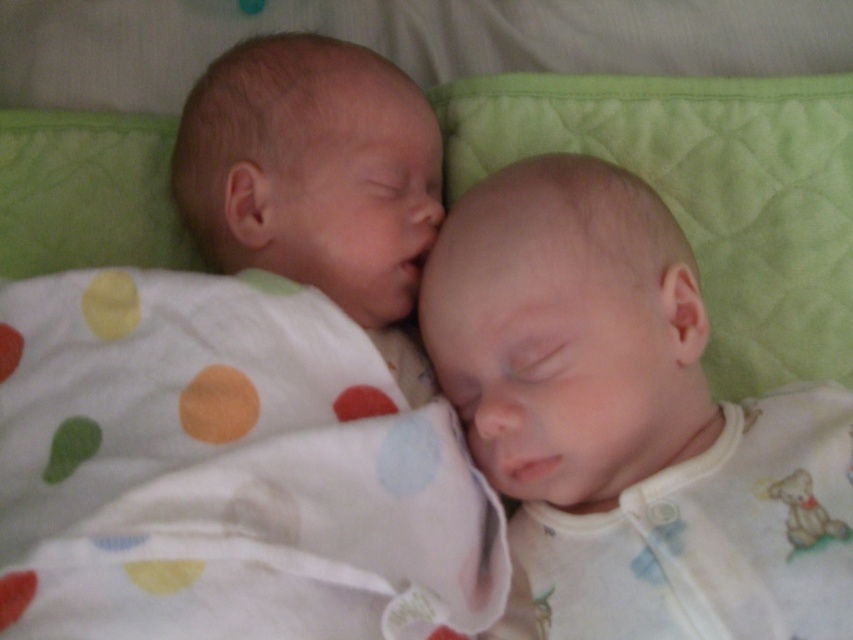
Does point (218, 109) come in front of point (782, 500)?

No, (218, 109) is behind (782, 500).

Between smooth skin newborn at center and smooth white baby at center, which one has more height?

Standing taller between the two is smooth skin newborn at center.

Is point (183, 454) positioned behind point (544, 198)?

No.

Where is `smooth skin newborn at center`? smooth skin newborn at center is located at coordinates (251, 390).